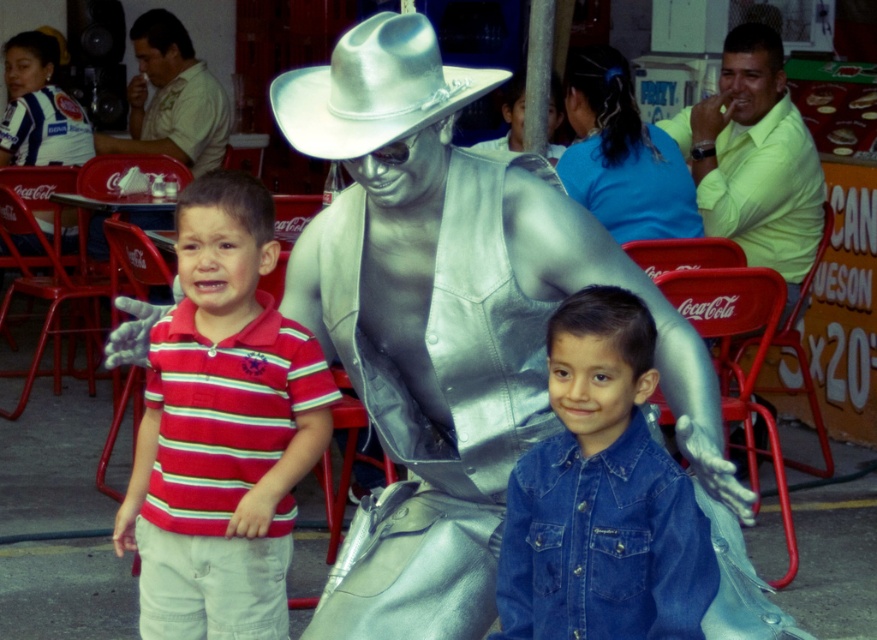
Question: Which point is closer to the camera?

Choices:
 (A) (383, 45)
 (B) (661, 556)
 (C) (739, 44)

Answer: (B)

Question: Which object is closer to the camera taking this photo?

Choices:
 (A) matte yellow shirt at upper left
 (B) striped cotton shirt at left
 (C) silver metallic cowboy at center

Answer: (C)

Question: Is silver metallic cowboy at center to the left of denim shirt at center from the viewer's perspective?

Choices:
 (A) yes
 (B) no

Answer: (A)

Question: Considering the real-world distances, which object is closest to the light green shirt at right?

Choices:
 (A) matte yellow shirt at upper left
 (B) striped cotton shirt at left
 (C) silver metallic cowboy hat at center
 (D) denim shirt at center

Answer: (B)

Question: Observing the image, what is the correct spatial positioning of denim shirt at center in reference to light green shirt at right?

Choices:
 (A) above
 (B) below

Answer: (B)

Question: Can you confirm if striped cotton shirt at left is positioned to the right of matte yellow shirt at upper left?

Choices:
 (A) no
 (B) yes

Answer: (B)